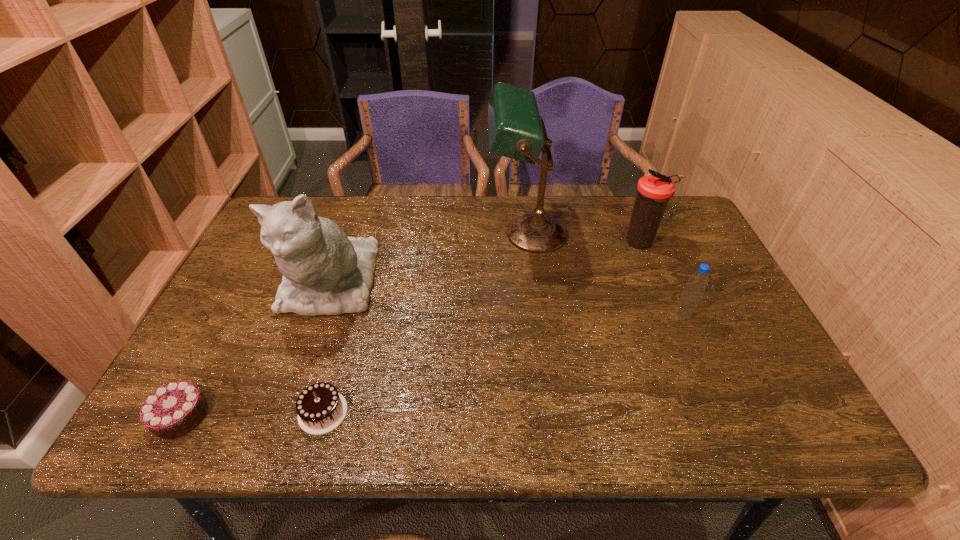
Where is `free space between the third shortest object and the tallest object`? free space between the third shortest object and the tallest object is located at coordinates (605, 274).

Find the location of a particular element. free space between the right chocolate cake and the table lamp is located at coordinates (425, 323).

What are the coordinates of `unoccupied position between the right chocolate cake and the table lamp` in the screenshot? It's located at (425, 323).

Locate an element on the screen. The height and width of the screenshot is (540, 960). free space between the water bottle and the third tallest object is located at coordinates (661, 279).

Locate an element on the screen. The width and height of the screenshot is (960, 540). empty space that is in between the thermos bottle and the right chocolate cake is located at coordinates (482, 328).

I want to click on free space between the third object from right to left and the thermos bottle, so click(584, 239).

At what (x,y) coordinates should I click in order to perform the action: click on blank region between the cat and the table lamp. Please return your answer as a coordinate pair (x, y). Looking at the image, I should click on (429, 258).

The width and height of the screenshot is (960, 540). I want to click on empty space between the leftmost object and the table lamp, so tap(354, 325).

This screenshot has width=960, height=540. I want to click on unoccupied position between the left chocolate cake and the cat, so click(x=255, y=349).

Locate an element on the screen. object that is the closest to the right chocolate cake is located at coordinates (325, 272).